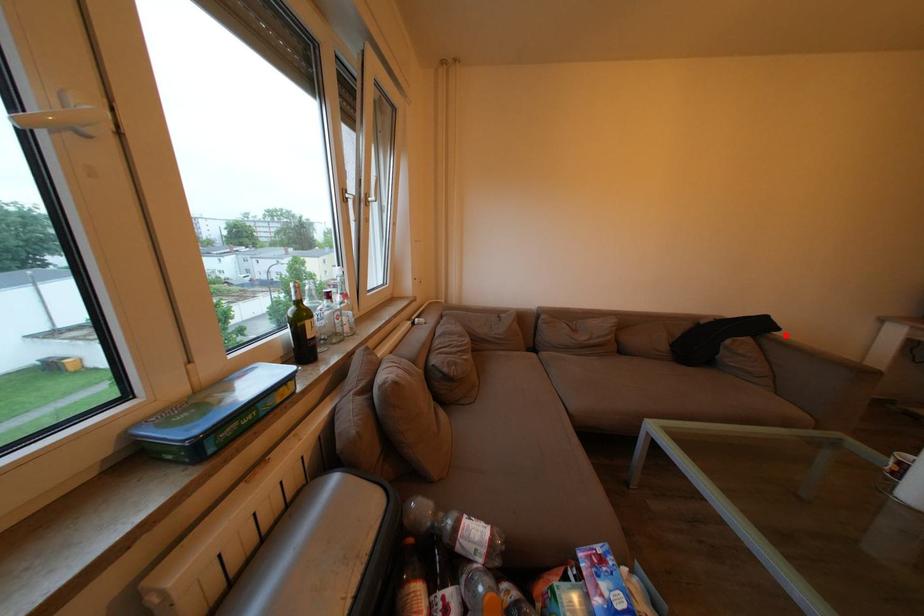
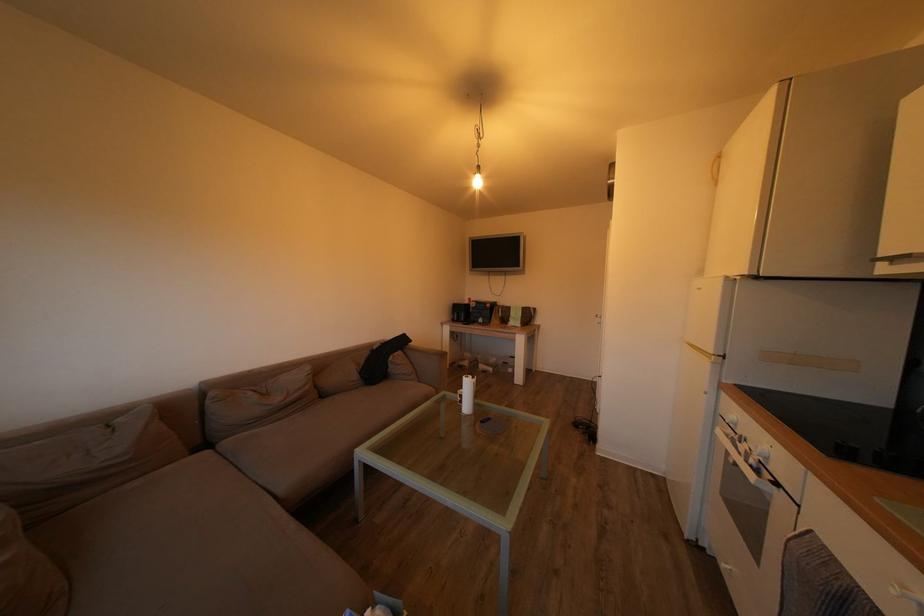
Locate, in the second image, the point that corresponds to the highlighted location in the first image.

(419, 347)